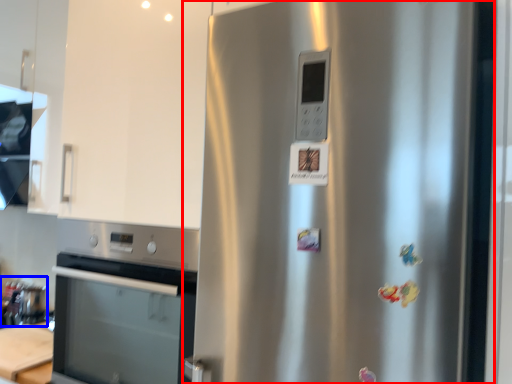
Question: Which point is further to the camera, refrigerator (highlighted by a red box) or appliance (highlighted by a blue box)?

Choices:
 (A) refrigerator
 (B) appliance

Answer: (B)